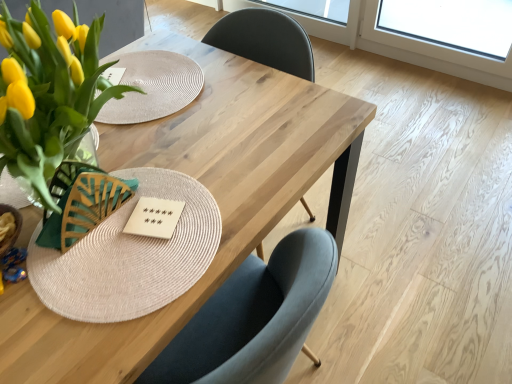
Measure the distance between wooden card game at center and camera.

wooden card game at center is 32.81 inches away from camera.

Describe the element at coordinates (210, 191) in the screenshot. I see `natural wood table at center` at that location.

The image size is (512, 384). Describe the element at coordinates (48, 92) in the screenshot. I see `matte glass vase with yellow tulips at left` at that location.

Locate an element on the screen. Image resolution: width=512 pixels, height=384 pixels. wooden card game at center is located at coordinates (154, 218).

Between point (153, 223) and point (181, 150), which one is positioned in front?

The point (153, 223) is closer.

What's the angular difference between wooden card game at center and natural wood table at center's facing directions?

wooden card game at center and natural wood table at center are facing 117 degrees away from each other.

Is wooden card game at center wider than natural wood table at center?

No, wooden card game at center is not wider than natural wood table at center.

Considering the relative positions of wooden card game at center and natural wood table at center in the image provided, is wooden card game at center to the left of natural wood table at center from the viewer's perspective?

In fact, wooden card game at center is to the right of natural wood table at center.

This screenshot has width=512, height=384. Identify the location of window screen behind the wooden card game at center. (314, 8).

Looking at this image, does transparent glass window screen at upper center turn towards wooden card game at center?

No, transparent glass window screen at upper center does not turn towards wooden card game at center.

Is transparent glass window screen at upper center spatially inside natural wood table at center, or outside of it?

transparent glass window screen at upper center cannot be found inside natural wood table at center.

Is transparent glass window screen at upper center taller or shorter than natural wood table at center?

Considering their sizes, transparent glass window screen at upper center has less height than natural wood table at center.

Is transparent glass window screen at upper center far from natural wood table at center?

transparent glass window screen at upper center is far away from natural wood table at center.

Is transparent glass window screen at upper center aimed at natural wood table at center?

Yes, transparent glass window screen at upper center is oriented towards natural wood table at center.

Who is smaller, transparent glass window screen at upper center or matte glass vase with yellow tulips at left?

With smaller size is transparent glass window screen at upper center.

Is point (325, 12) closer to viewer compared to point (67, 98)?

No, (325, 12) is behind (67, 98).

Between transparent glass window screen at upper center and matte glass vase with yellow tulips at left, which one has more height?

Standing taller between the two is matte glass vase with yellow tulips at left.

Does point (24, 123) come farther from viewer compared to point (130, 227)?

No, it is not.

From the image's perspective, would you say matte glass vase with yellow tulips at left is positioned over wooden card game at center?

Yes, from the image's perspective, matte glass vase with yellow tulips at left is on top of wooden card game at center.

Considering the relative sizes of matte glass vase with yellow tulips at left and wooden card game at center in the image provided, is matte glass vase with yellow tulips at left bigger than wooden card game at center?

Indeed, matte glass vase with yellow tulips at left has a larger size compared to wooden card game at center.

Is matte glass vase with yellow tulips at left aimed at wooden card game at center?

No, matte glass vase with yellow tulips at left is not turned towards wooden card game at center.

Which object is positioned more to the right, natural wood table at center or matte glass vase with yellow tulips at left?

From the viewer's perspective, natural wood table at center appears more on the right side.

Does natural wood table at center have a greater height compared to matte glass vase with yellow tulips at left?

Correct, natural wood table at center is much taller as matte glass vase with yellow tulips at left.

Is natural wood table at center positioned with its back to matte glass vase with yellow tulips at left?

No, natural wood table at center is not facing the opposite direction of matte glass vase with yellow tulips at left.

From a real-world perspective, which object stands above the other?

matte glass vase with yellow tulips at left.

Who is taller, matte glass vase with yellow tulips at left or transparent glass window screen at upper center?

With more height is matte glass vase with yellow tulips at left.

From the image's perspective, is matte glass vase with yellow tulips at left located above or below transparent glass window screen at upper center?

Based on their image positions, matte glass vase with yellow tulips at left is located beneath transparent glass window screen at upper center.

Are matte glass vase with yellow tulips at left and transparent glass window screen at upper center located far from each other?

Yes.

Locate an element on the screen. The image size is (512, 384). card game above the natural wood table at center (from the image's perspective) is located at coordinates (154, 218).

Where is `window screen located behind the wooden card game at center`? The height and width of the screenshot is (384, 512). window screen located behind the wooden card game at center is located at coordinates (314, 8).

From the image, which object appears to be nearer to transparent glass window screen at upper center, matte glass vase with yellow tulips at left or natural wood table at center?

natural wood table at center is positioned closer to the anchor transparent glass window screen at upper center.

From the image, which object appears to be nearer to transparent glass window screen at upper center, wooden card game at center or natural wood table at center?

natural wood table at center.

Which object lies further to the anchor point transparent glass window screen at upper center, wooden card game at center or matte glass vase with yellow tulips at left?

Among the two, wooden card game at center is located further to transparent glass window screen at upper center.

Looking at the image, which one is located closer to matte glass vase with yellow tulips at left, natural wood table at center or transparent glass window screen at upper center?

natural wood table at center.

Based on their spatial positions, is natural wood table at center or wooden card game at center further from matte glass vase with yellow tulips at left?

Among the two, natural wood table at center is located further to matte glass vase with yellow tulips at left.

Considering their positions, is natural wood table at center positioned closer to transparent glass window screen at upper center than matte glass vase with yellow tulips at left?

natural wood table at center lies closer to transparent glass window screen at upper center than the other object.

Considering their positions, is wooden card game at center positioned further to natural wood table at center than matte glass vase with yellow tulips at left?

Among the two, matte glass vase with yellow tulips at left is located further to natural wood table at center.

Which object lies further to the anchor point wooden card game at center, matte glass vase with yellow tulips at left or natural wood table at center?

The object further to wooden card game at center is natural wood table at center.

At what (x,y) coordinates should I click in order to perform the action: click on card game between matte glass vase with yellow tulips at left and transparent glass window screen at upper center along the z-axis. Please return your answer as a coordinate pair (x, y). Looking at the image, I should click on point(154,218).

Locate an element on the screen. Image resolution: width=512 pixels, height=384 pixels. card game between natural wood table at center and transparent glass window screen at upper center from front to back is located at coordinates (154, 218).

The image size is (512, 384). Identify the location of table between matte glass vase with yellow tulips at left and transparent glass window screen at upper center from front to back. (210, 191).

Find the location of `table between matte glass vase with yellow tulips at left and wooden card game at center along the z-axis`. table between matte glass vase with yellow tulips at left and wooden card game at center along the z-axis is located at coordinates (210, 191).